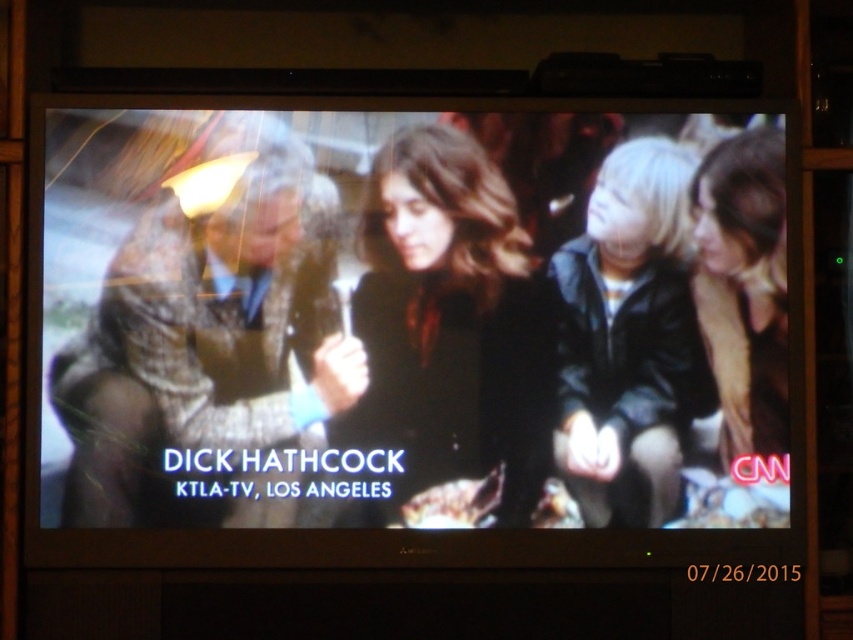
Between brown textured coat at left and black leather jacket at right, which one appears on the left side from the viewer's perspective?

From the viewer's perspective, brown textured coat at left appears more on the left side.

Is point (350, 346) positioned in front of point (567, 317)?

Yes, it is in front of point (567, 317).

Find the location of a particular element. brown textured coat at left is located at coordinates (207, 355).

How much distance is there between matte black jacket at center and black leather jacket at right?

16.59 inches

Can you confirm if matte black jacket at center is taller than black leather jacket at right?

Yes, matte black jacket at center is taller than black leather jacket at right.

Is point (292, 468) closer to camera compared to point (646, 429)?

Yes, it is.

Find the location of a particular element. The height and width of the screenshot is (640, 853). matte black jacket at center is located at coordinates (410, 321).

Which of these two, matte black coat at center or black leather jacket at right, stands taller?

matte black coat at center is taller.

Which is in front, point (477, 307) or point (656, 182)?

Positioned in front is point (477, 307).

At what (x,y) coordinates should I click in order to perform the action: click on matte black coat at center. Please return your answer as a coordinate pair (x, y). The height and width of the screenshot is (640, 853). Looking at the image, I should click on (448, 333).

You are a GUI agent. You are given a task and a screenshot of the screen. Output one action in this format:
    pyautogui.click(x=<x>, y=<y>)
    Task: Click on the matte black coat at center
    The image size is (853, 640).
    Given the screenshot: What is the action you would take?
    pyautogui.click(x=448, y=333)